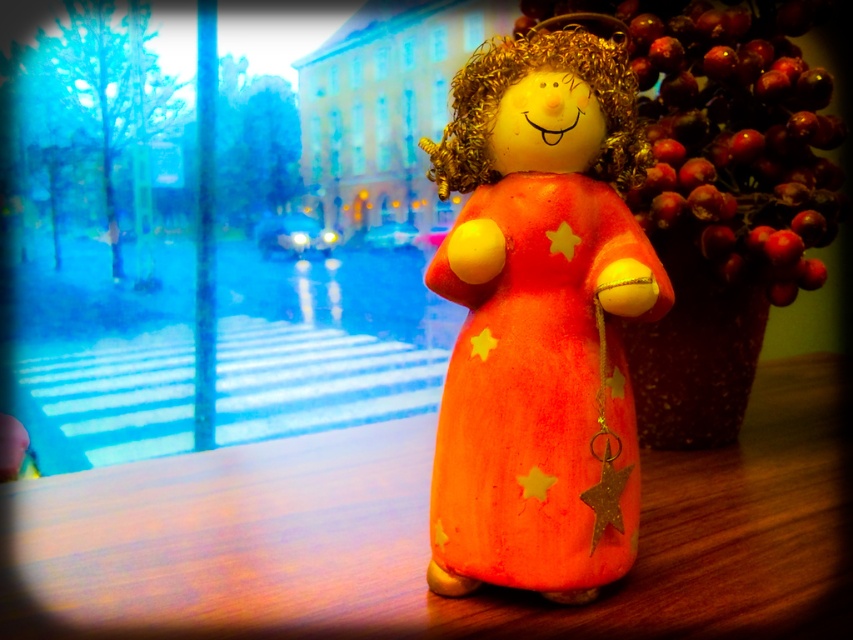
You are organizing a craft fair and need to display the orange felt dress at center on the orange felt table at center. Considering their sizes, will the dress fit comfortably on the table without hanging off the edges?

The orange felt table at center has a larger size compared to orange felt dress at center, so the dress will fit comfortably on the table without hanging off the edges.

You are an interior designer arranging a display shelf. You have the orange felt dress at center and the shiny red berries at right. Based on their sizes, which object should you place on the lower shelf to ensure stability?

The orange felt dress at center has a lesser height compared to the shiny red berries at right, so it should be placed on the lower shelf to ensure stability.